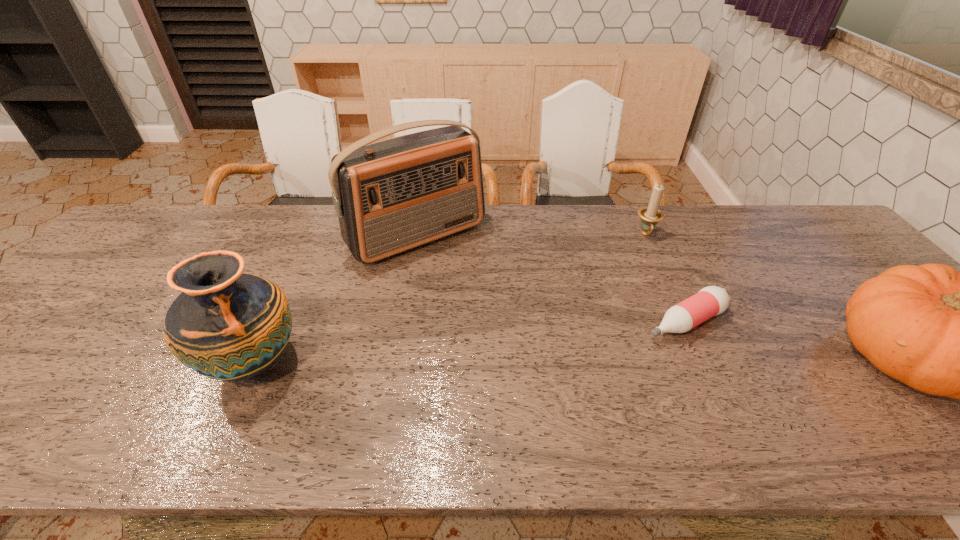
This screenshot has height=540, width=960. In the image, there is a desktop. Find the location of `vacant space at the near edge`. vacant space at the near edge is located at coordinates (616, 403).

The image size is (960, 540). Identify the location of free space at the far left corner. (177, 207).

Image resolution: width=960 pixels, height=540 pixels. Identify the location of vacant region at the far right corner of the desktop. (766, 212).

Find the location of a particular element. This screenshot has width=960, height=540. blank region between the leftmost object and the second shortest object is located at coordinates (449, 299).

Locate an element on the screen. Image resolution: width=960 pixels, height=540 pixels. free space between the fourth tallest object and the fourth shortest object is located at coordinates (449, 299).

Locate an element on the screen. The height and width of the screenshot is (540, 960). free point between the pottery and the radio receiver is located at coordinates (335, 299).

In order to click on vacant area that lies between the bottle and the leftmost object in this screenshot , I will do `click(469, 342)`.

You are a GUI agent. You are given a task and a screenshot of the screen. Output one action in this format:
    pyautogui.click(x=<x>, y=<y>)
    Task: Click on the free space between the radio receiver and the shortest object
    The height and width of the screenshot is (540, 960).
    Given the screenshot: What is the action you would take?
    pyautogui.click(x=551, y=279)

Find the location of `vacant region between the second shortest object and the fourth shortest object`. vacant region between the second shortest object and the fourth shortest object is located at coordinates (449, 299).

Choose which object is the nearest neighbor to the shortest object. Please provide its 2D coordinates. Your answer should be formatted as a tuple, i.e. [(x, y)], where the tuple contains the x and y coordinates of a point satisfying the conditions above.

[(957, 334)]